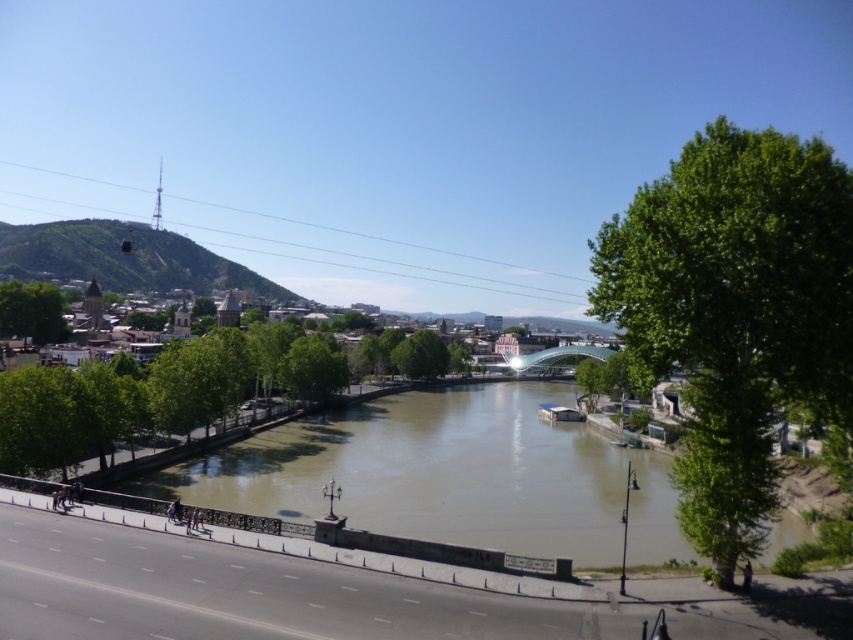
You are a bird looking for a place to perch. You see two trees in the scene, the green leafy tree at right and the green leafy tree at center. Which tree is nearer to you?

The green leafy tree at right is closer to the viewer than the green leafy tree at center, so the bird should choose the green leafy tree at right to perch as it is nearer.

You are a drone operator planning to fly a drone from point A to point B in the image. Point A is at coordinate point (x=730, y=580) and point B is at coordinate point (x=49, y=317). According to the scene description, which point is closer to the drone operator when it starts?

Point (x=730, y=580) is in front of point (x=49, y=317), so the drone operator is closer to point (x=730, y=580) when starting.